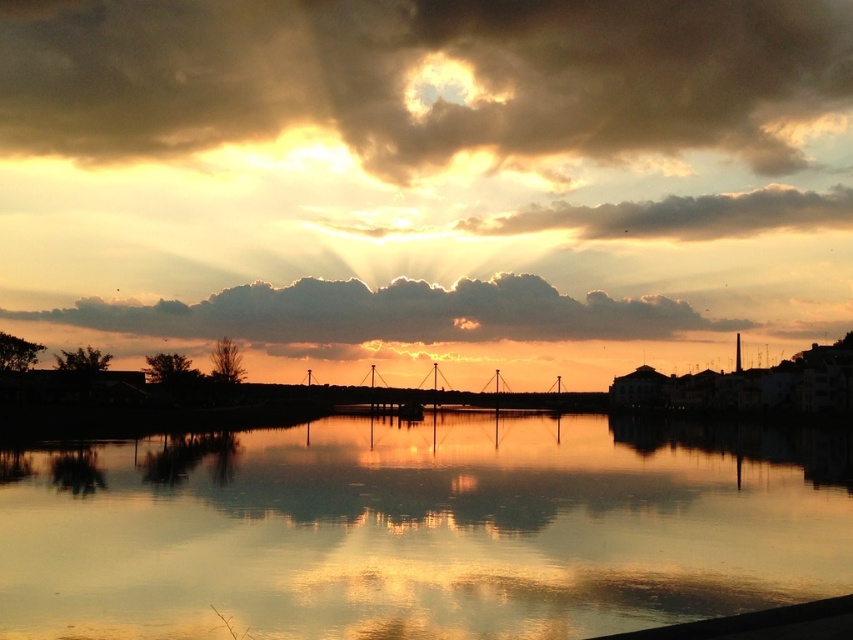
Based on the photo, you are standing at the point labeled point (x=71, y=317) and want to take a photo of the sunset. There is an obstruction at point (x=595, y=212). Will the obstruction block your view of the sunset?

Point (x=71, y=317) is closer to the camera than point (x=595, y=212), so the obstruction at point (x=595, y=212) will not block your view of the sunset because it is farther away.

You are an astronomer analyzing the position of celestial objects in the sunset scene. Given that the cloudy sky at upper center is located at coordinates 0.122 in the x and 0.496 in the y, can you determine its position relative to the center of the image?

The cloudy sky at upper center is located at coordinates x 0.122 and y 0.496. Since the center of the image is at x 0.5 and y 0.5, the cloudy sky at upper center is positioned to the left and slightly below the center.

You are standing at the edge of the water in the sunset scene. There is a point marked at coordinates (422, 77). What does this point indicate in the scene?

The point at coordinates (422, 77) marks the cloudy sky at upper center in the scene.